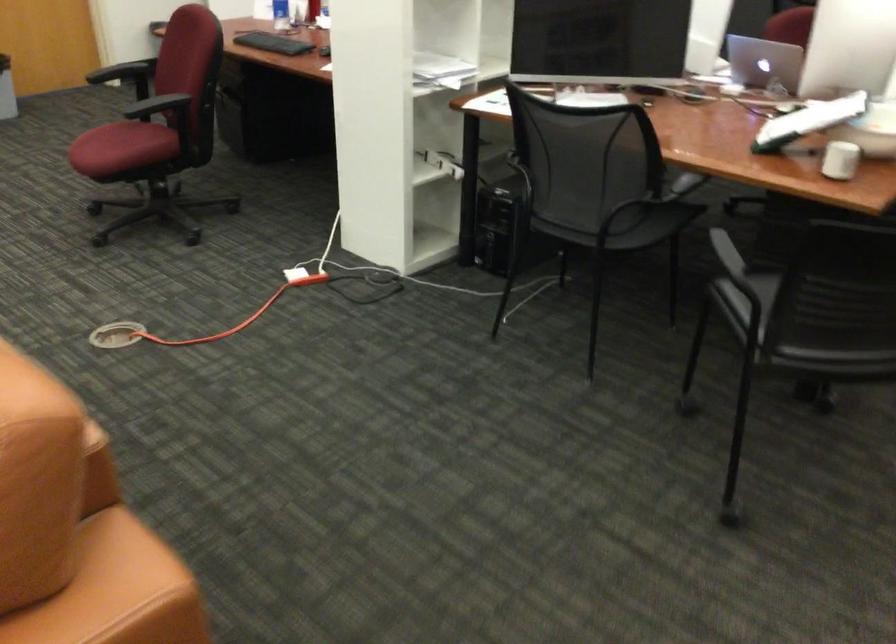
At what (x,y) coordinates should I click in order to perform the action: click on brown sofa armrest. Please return your answer as a coordinate pair (x, y). Looking at the image, I should click on tap(40, 469).